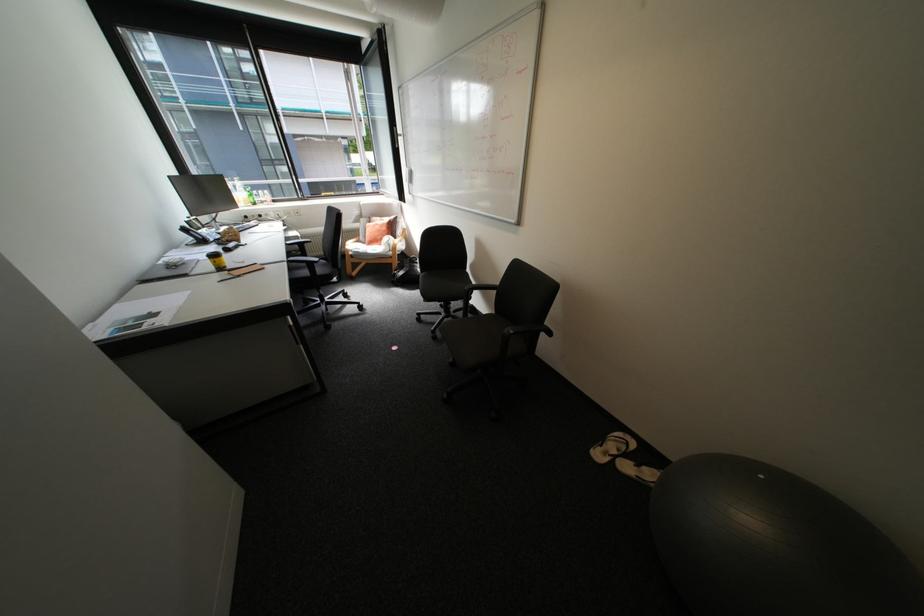
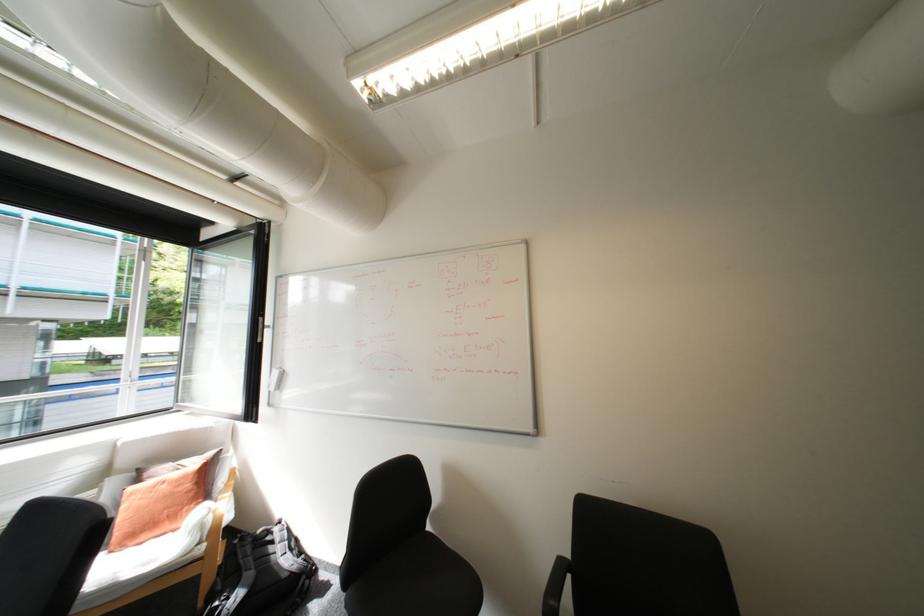
In the second image, find the point that corresponds to the point at 386,225 in the first image.

(175, 485)